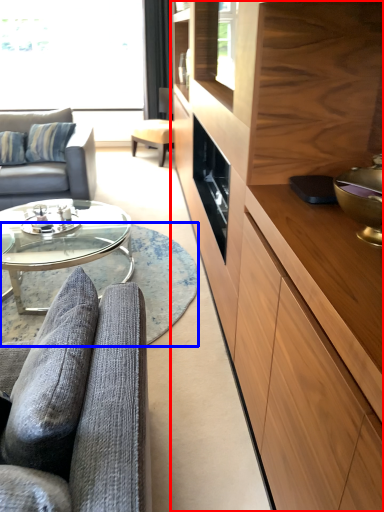
Question: Among these objects, which one is farthest to the camera, cabinetry (highlighted by a red box) or plain (highlighted by a blue box)?

Choices:
 (A) cabinetry
 (B) plain

Answer: (B)